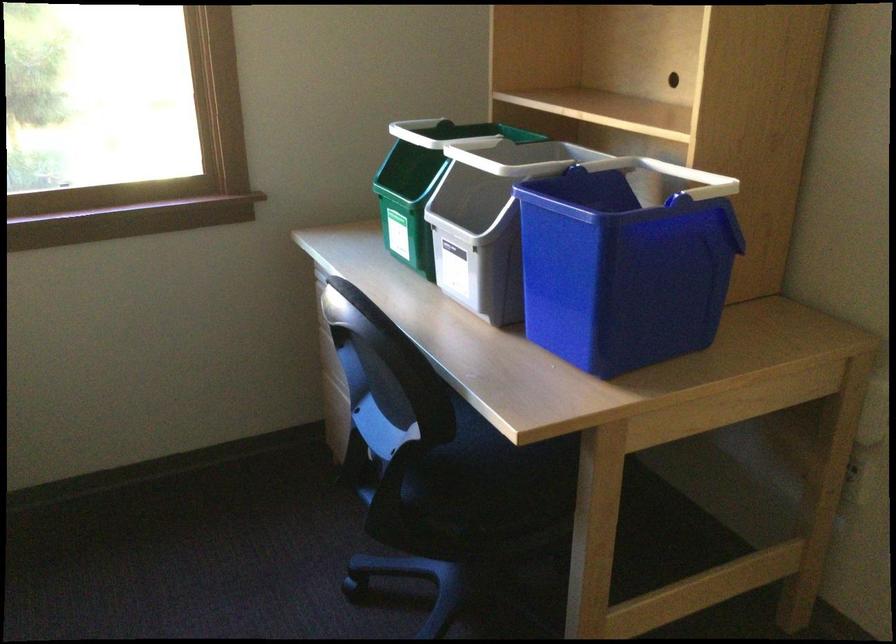
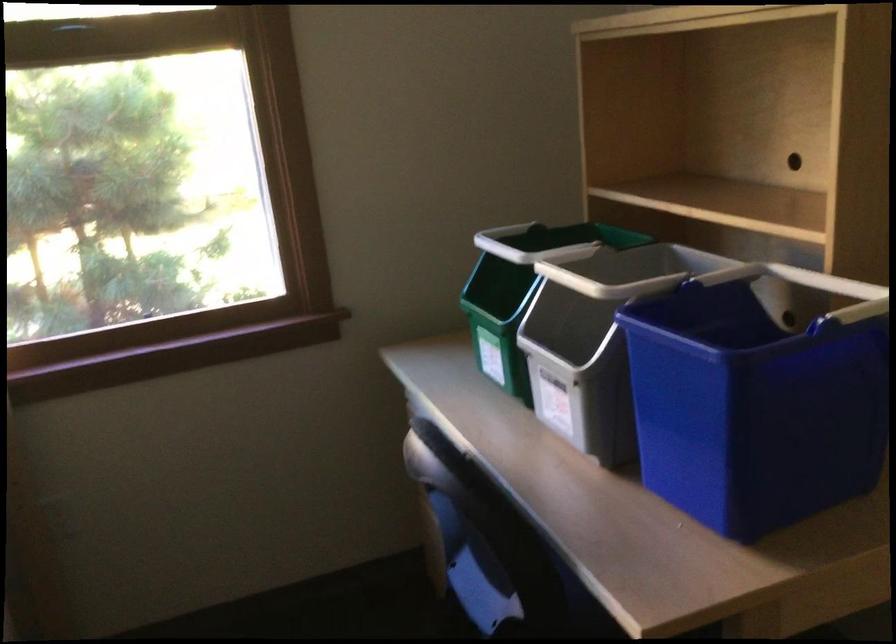
Question: The camera is either moving clockwise (left) or counter-clockwise (right) around the object. The first image is from the beginning of the video and the second image is from the end. Is the camera moving left or right when shooting the video?

Choices:
 (A) Left
 (B) Right

Answer: (B)